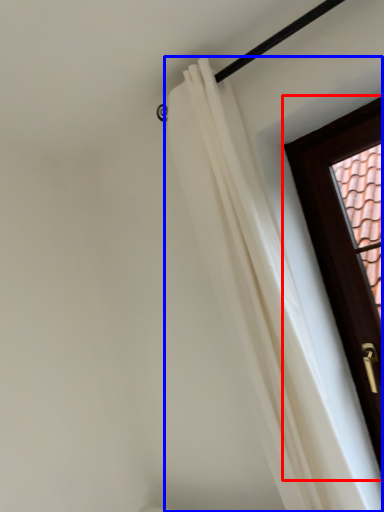
Question: Which object appears farthest to the camera in this image, door (highlighted by a red box) or curtain (highlighted by a blue box)?

Choices:
 (A) door
 (B) curtain

Answer: (A)